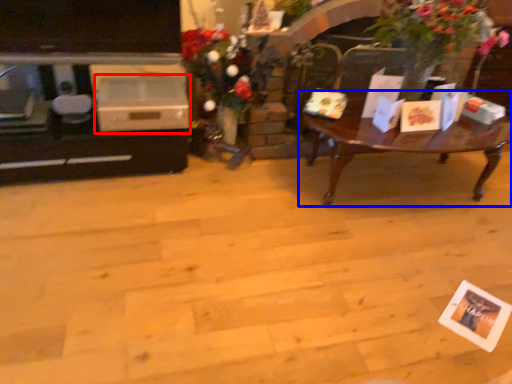
Question: Which of the following is the farthest to the observer, appliance (highlighted by a red box) or coffee table (highlighted by a blue box)?

Choices:
 (A) appliance
 (B) coffee table

Answer: (A)